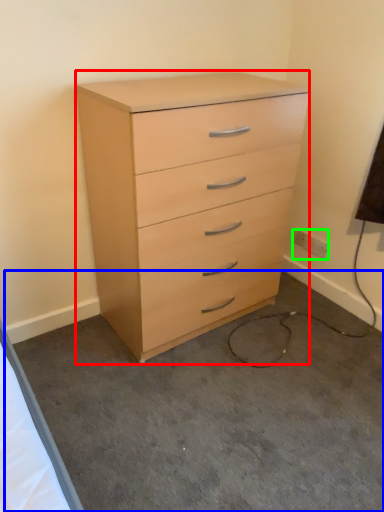
Question: Estimate the real-world distances between objects in this image. Which object is closer to chest of drawers (highlighted by a red box), concrete (highlighted by a blue box) or electric outlet (highlighted by a green box)?

Choices:
 (A) concrete
 (B) electric outlet

Answer: (A)